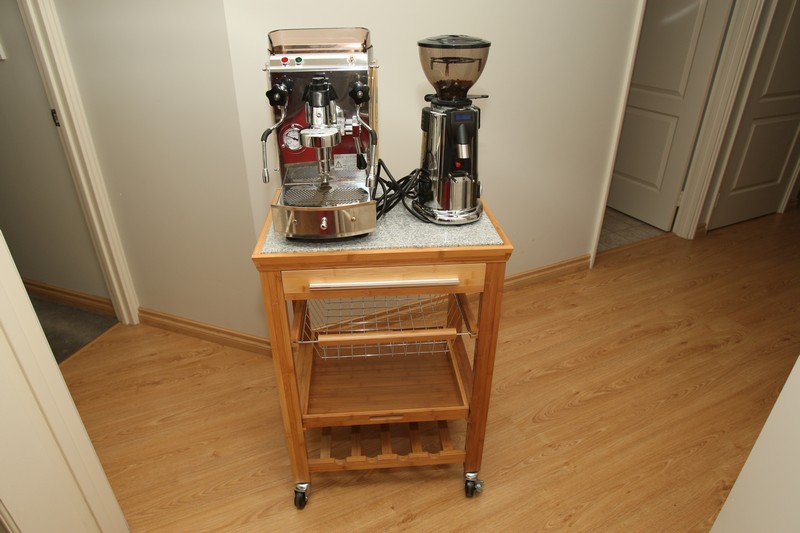
Identify the location of appliances. (320, 216), (448, 187).